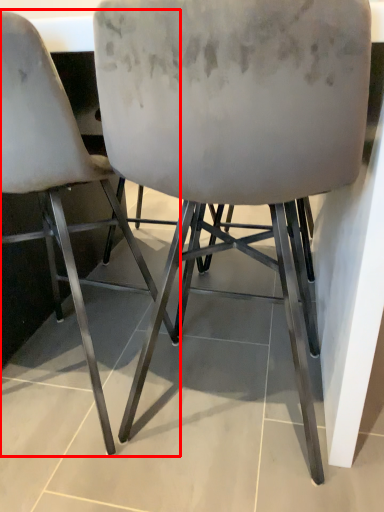
Question: From the image's perspective, considering the relative positions of chair (annotated by the red box) and chair in the image provided, where is chair (annotated by the red box) located with respect to the staircase?

Choices:
 (A) above
 (B) below

Answer: (A)